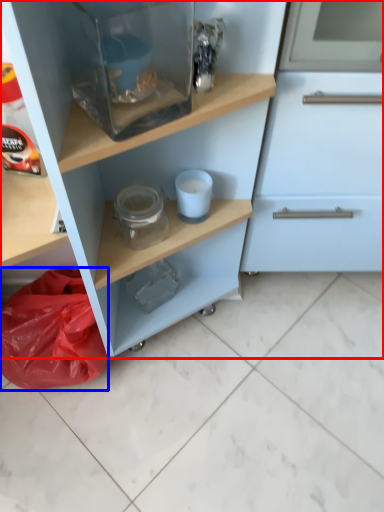
Question: Among these objects, which one is farthest to the camera, cupboard (highlighted by a red box) or material (highlighted by a blue box)?

Choices:
 (A) cupboard
 (B) material

Answer: (B)